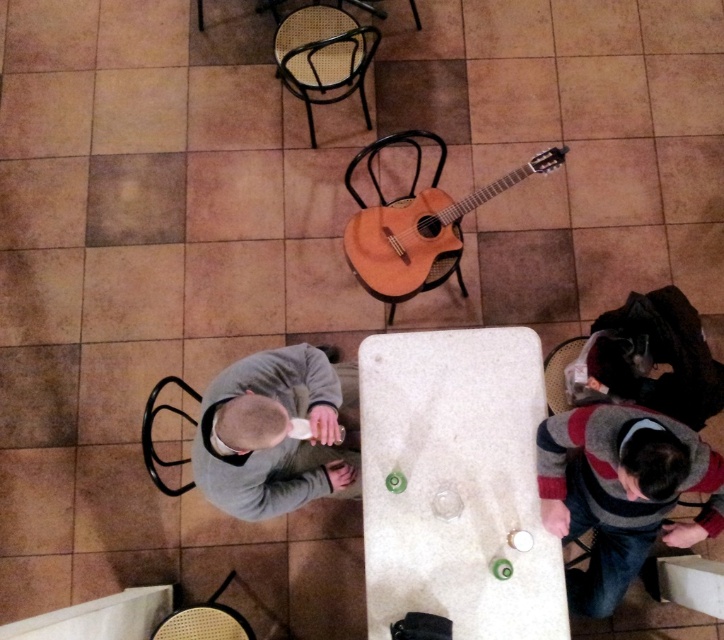
You are standing at the edge of the table in the center of the image. You see two points on the table surface. The first point is located at coordinates point (416, 506) and the second point is at point (458, 252). If you want to move from your current position to the point that is further away from you, which coordinate should you head towards?

Point (458, 252) is further away from your current position because it is behind point (416, 506), which is in front of it.

You are a customer entering the cafe and want to sit at the table. Which chair should you choose if you want to sit closer to the entrance? The options are the rattan chair at lower left and the black plastic chair at lower left.

The rattan chair at lower left is below the black plastic chair at lower left, so the rattan chair is closer to the entrance and should be chosen.

Looking at this image, you are a customer sitting at the white marble table at center in a cafe. You want to place your light brown wood guitar at center on the floor to make more space on the table. Is the table tall enough for you to easily reach the guitar when it is on the floor?

The white marble table at center is taller than the light brown wood guitar at center. Since the table is taller, placing the guitar on the floor would mean it is lower than the table surface. This should allow you to easily reach it while sitting at the table.